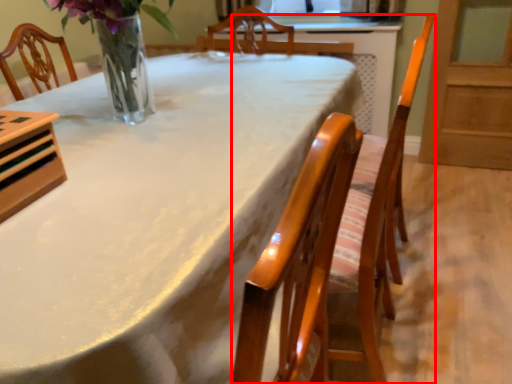
Question: Considering the relative positions of chair (annotated by the red box) and table in the image provided, where is chair (annotated by the red box) located with respect to the staircase?

Choices:
 (A) left
 (B) right

Answer: (B)